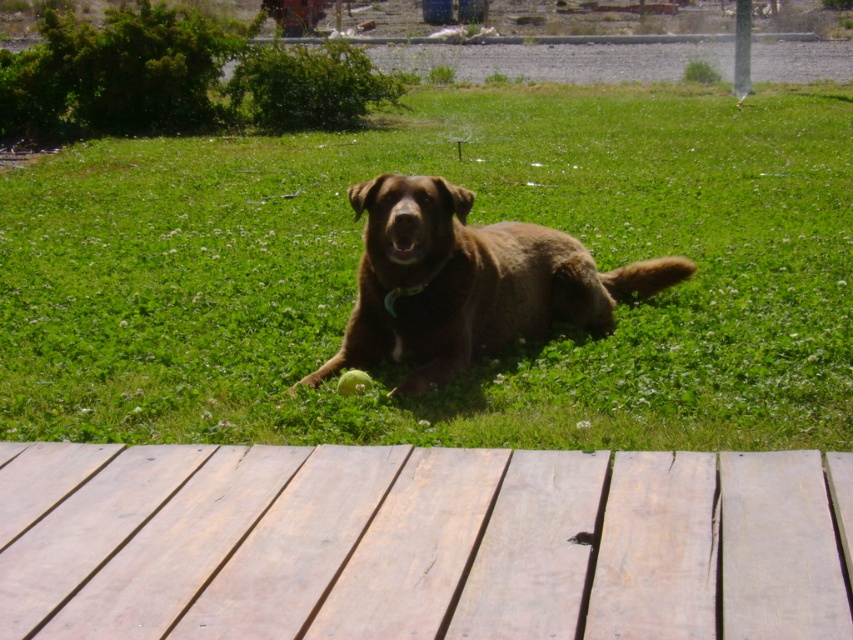
Question: Which object is closer to the camera taking this photo?

Choices:
 (A) green grass at center
 (B) green fabric neckband at center
 (C) brown furry dog at center
 (D) light brown wooden deck at lower center

Answer: (D)

Question: Can you confirm if light brown wooden deck at lower center is positioned to the left of brown furry dog at center?

Choices:
 (A) yes
 (B) no

Answer: (A)

Question: Is the position of green grass at center more distant than that of green fabric neckband at center?

Choices:
 (A) yes
 (B) no

Answer: (B)

Question: Which is farther from the green grass at center?

Choices:
 (A) light brown wooden deck at lower center
 (B) green fabric neckband at center
 (C) brown furry dog at center

Answer: (B)

Question: Which point is farther to the camera?

Choices:
 (A) brown furry dog at center
 (B) light brown wooden deck at lower center

Answer: (A)

Question: Can you confirm if light brown wooden deck at lower center is smaller than green fabric neckband at center?

Choices:
 (A) no
 (B) yes

Answer: (A)